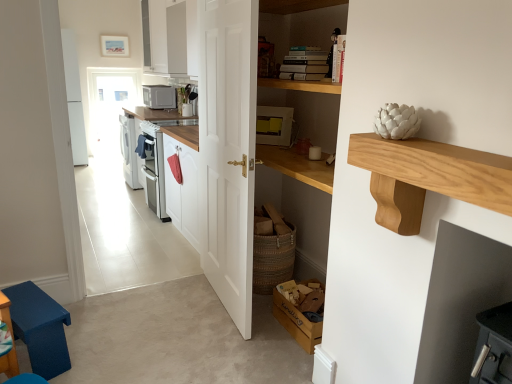
Question: Based on their positions, is wooden cardboard box at lower center located to the left or right of matte gray microwave at upper center, acting as the second appliance starting from the right?

Choices:
 (A) left
 (B) right

Answer: (B)

Question: In terms of width, does wooden cardboard box at lower center look wider or thinner when compared to matte gray microwave at upper center, the 1th appliance when ordered from left to right?

Choices:
 (A) wide
 (B) thin

Answer: (B)

Question: Which of these objects is positioned closest to the matte yellow appliance at center, acting as the 2th appliance starting from the top?

Choices:
 (A) matte gray microwave at upper center, which is the first appliance in back-to-front order
 (B) light wood shelf at upper right
 (C) white glossy microwave at upper center
 (D) wooden cardboard box at lower center
 (E) white wooden door at center

Answer: (E)

Question: Considering the real-world distances, which object is closest to the white wooden door at center?

Choices:
 (A) wooden cardboard box at lower center
 (B) matte gray microwave at upper center, the 1th appliance when ordered from left to right
 (C) blue fabric step stool at lower left
 (D) white glossy microwave at upper center
 (E) matte yellow appliance at center, which ranks as the second appliance in back-to-front order

Answer: (E)